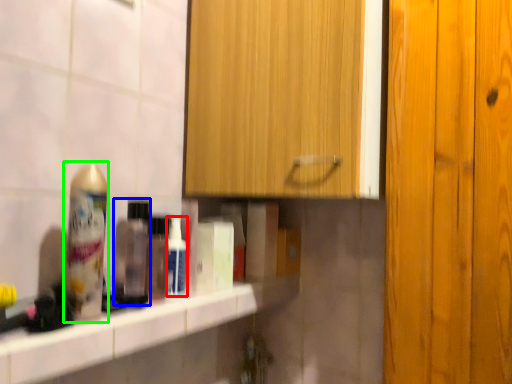
Question: Which is farther away from mouthwash (highlighted by a red box)? mouthwash (highlighted by a blue box) or shaving cream (highlighted by a green box)?

Choices:
 (A) mouthwash
 (B) shaving cream

Answer: (B)